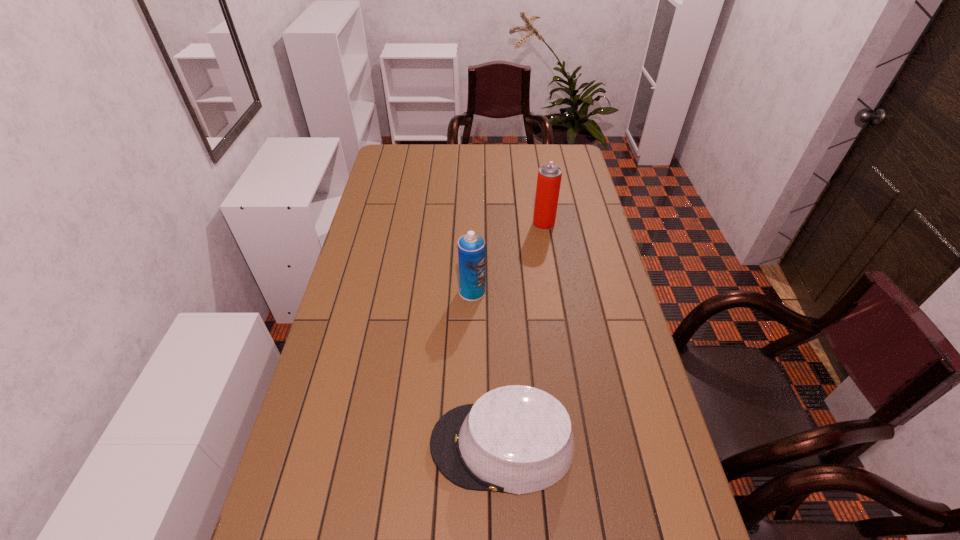
Identify which object is located as the second nearest to the farther aerosol can. Please provide its 2D coordinates. Your answer should be formatted as a tuple, i.e. [(x, y)], where the tuple contains the x and y coordinates of a point satisfying the conditions above.

[(516, 439)]

Where is `vacant space that satisfies the following two spatial constraints: 1. on the back side of the nearer aerosol can; 2. on the right side of the right aerosol can`? The image size is (960, 540). vacant space that satisfies the following two spatial constraints: 1. on the back side of the nearer aerosol can; 2. on the right side of the right aerosol can is located at coordinates coord(473,224).